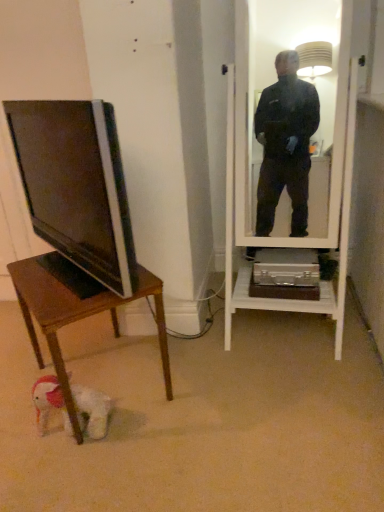
You are a GUI agent. You are given a task and a screenshot of the screen. Output one action in this format:
    pyautogui.click(x=<x>, y=<y>)
    Task: Click on the free space above wooden desk at lower left (from a real-world perspective)
    The image size is (384, 512).
    Given the screenshot: What is the action you would take?
    pyautogui.click(x=53, y=282)